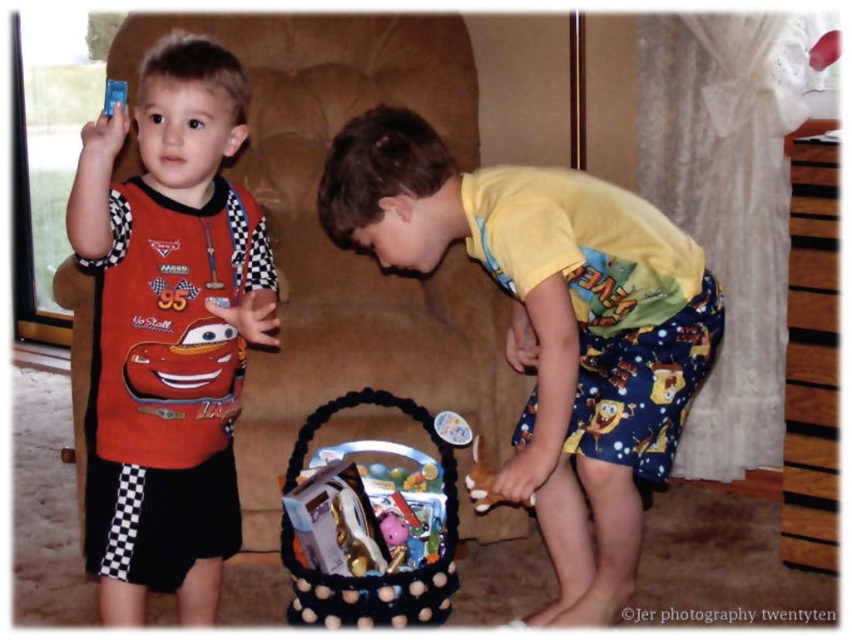
Question: Among these points, which one is farthest from the camera?

Choices:
 (A) (353, 220)
 (B) (496, 502)
 (C) (364, 301)

Answer: (C)

Question: Which of the following is the farthest from the observer?

Choices:
 (A) (407, 609)
 (B) (108, 618)

Answer: (A)

Question: Is brown fabric armchair at center in front of blue plastic phone at upper left?

Choices:
 (A) yes
 (B) no

Answer: (B)

Question: Is brown fabric armchair at center thinner than brown wooden toy at lower center?

Choices:
 (A) no
 (B) yes

Answer: (A)

Question: Among these points, which one is nearest to the camera?

Choices:
 (A) (108, 83)
 (B) (162, 387)
 (C) (346, 228)

Answer: (A)

Question: Is yellow cotton shirt at center bigger than brown wooden toy at lower center?

Choices:
 (A) no
 (B) yes

Answer: (B)